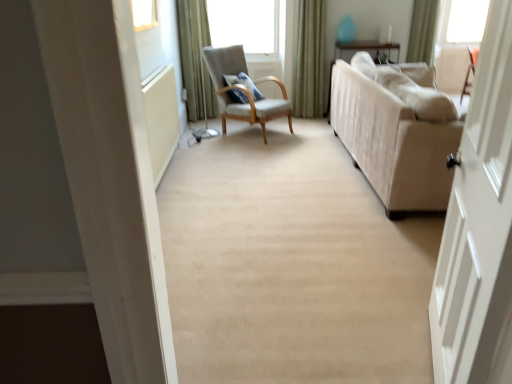
Question: Is beige fabric couch at right outside of green velvet curtain at upper right, which is the second curtain from left to right?

Choices:
 (A) no
 (B) yes

Answer: (B)

Question: Is beige fabric couch at right positioned with its back to green velvet curtain at upper right, which is the second curtain from left to right?

Choices:
 (A) yes
 (B) no

Answer: (B)

Question: Can you confirm if beige fabric couch at right is wider than green velvet curtain at upper right, which is the second curtain from left to right?

Choices:
 (A) no
 (B) yes

Answer: (B)

Question: Is beige fabric couch at right thinner than green velvet curtain at upper right, which is the second curtain from right to left?

Choices:
 (A) no
 (B) yes

Answer: (A)

Question: From the image's perspective, is beige fabric couch at right located above green velvet curtain at upper right, which is the second curtain from right to left?

Choices:
 (A) yes
 (B) no

Answer: (B)

Question: From a real-world perspective, is light gray fabric chair at center positioned above or below green fabric curtain at upper right, which is the first curtain in right-to-left order?

Choices:
 (A) above
 (B) below

Answer: (B)

Question: From the image's perspective, is light gray fabric chair at center above or below green fabric curtain at upper right, the third curtain when ordered from left to right?

Choices:
 (A) above
 (B) below

Answer: (B)

Question: Looking at the image, does light gray fabric chair at center seem bigger or smaller compared to green fabric curtain at upper right, which is the first curtain in right-to-left order?

Choices:
 (A) small
 (B) big

Answer: (B)

Question: Which is correct: light gray fabric chair at center is inside green fabric curtain at upper right, which is the first curtain in right-to-left order, or outside of it?

Choices:
 (A) inside
 (B) outside

Answer: (B)

Question: Is green velvet curtain at upper right, which is the second curtain from left to right, bigger or smaller than light gray fabric chair at center?

Choices:
 (A) small
 (B) big

Answer: (A)

Question: Choose the correct answer: Is green velvet curtain at upper right, which is the second curtain from right to left, inside light gray fabric chair at center or outside it?

Choices:
 (A) inside
 (B) outside

Answer: (B)

Question: Considering their positions, is green velvet curtain at upper right, which is the second curtain from right to left, located in front of or behind light gray fabric chair at center?

Choices:
 (A) behind
 (B) front

Answer: (A)

Question: From the image's perspective, relative to light gray fabric chair at center, is green velvet curtain at upper right, which is the second curtain from right to left, above or below?

Choices:
 (A) above
 (B) below

Answer: (A)

Question: Considering the positions of green velvet curtain at upper right, which is the second curtain from right to left, and beige fabric couch at right in the image, is green velvet curtain at upper right, which is the second curtain from right to left, bigger or smaller than beige fabric couch at right?

Choices:
 (A) small
 (B) big

Answer: (A)

Question: Is green velvet curtain at upper right, which is the second curtain from left to right, wider or thinner than beige fabric couch at right?

Choices:
 (A) thin
 (B) wide

Answer: (A)